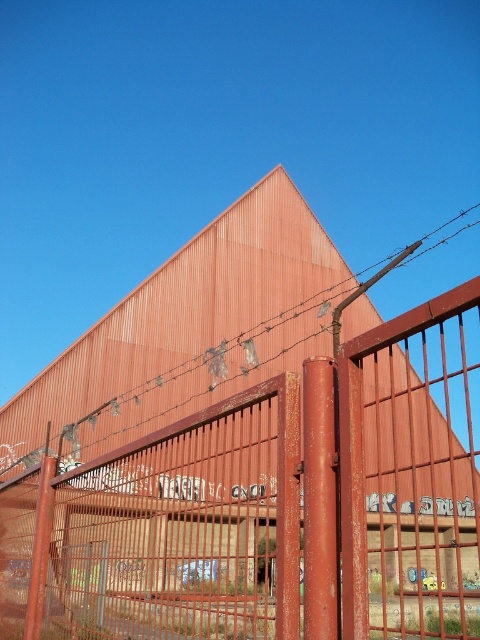
You are standing in front of the industrial building and want to enter through the rusty metal gate at center. Based on its 2D location coordinates, can you estimate where exactly the gate is positioned relative to the building?

The rusty metal gate at center is positioned at coordinates point (x=273, y=506), which means it is located towards the lower right side of the building.

You are standing in front of the industrial building and want to take a photo. There are two points marked on the fence, point (398, 529) and point (299, 310). Which point will appear larger in the photo?

Point (398, 529) is closer to the camera than point (299, 310), so it will appear larger in the photo.